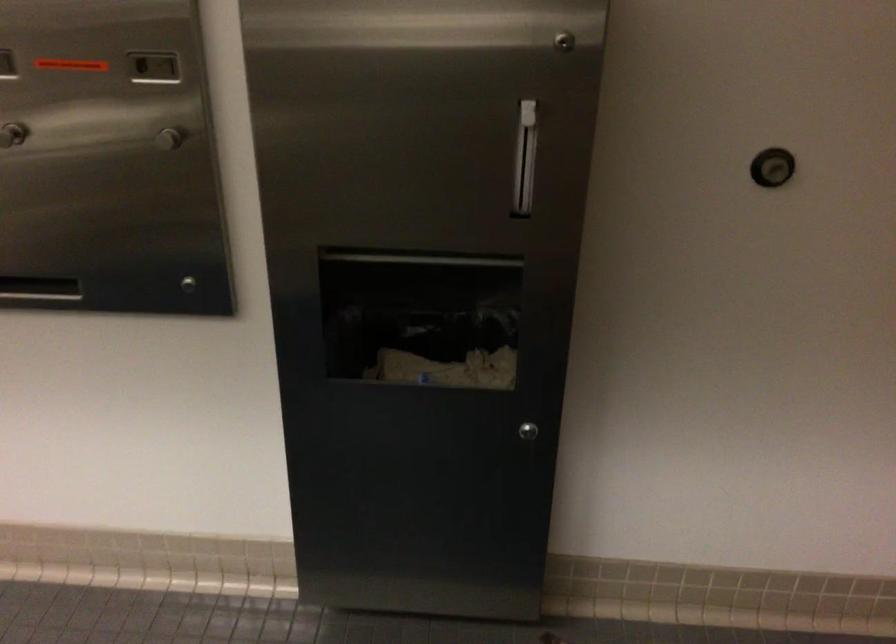
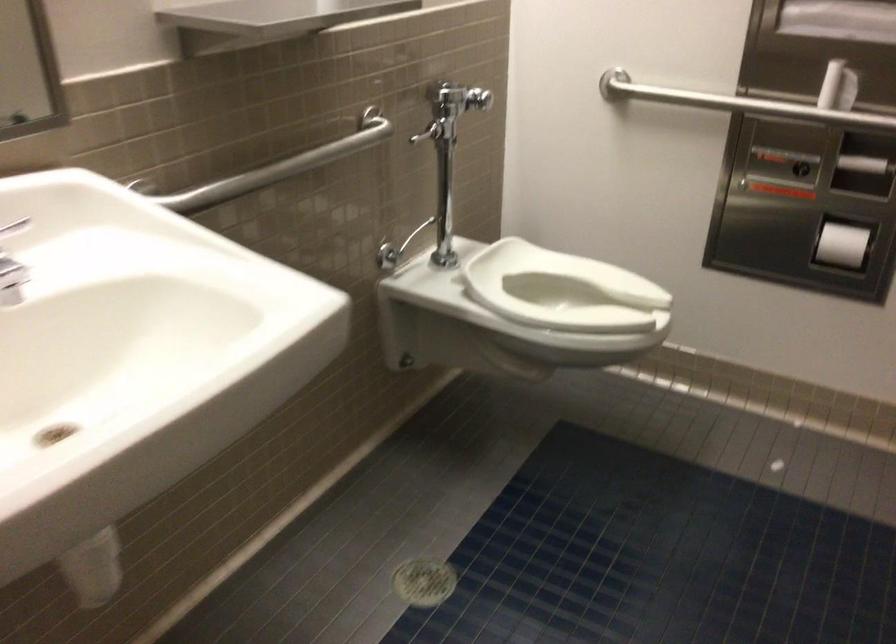
The images are taken continuously from a first-person perspective. In which direction is your viewpoint rotating?

The rotation direction of the camera is left-down.